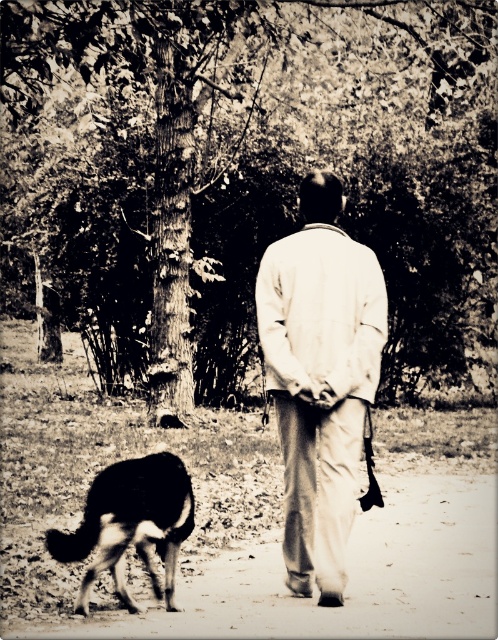
Based on the scene described, can you determine if the white cotton shirt at center is wider than the black fur dog at lower left?

The white cotton shirt at center might be wider than black fur dog at lower left according to the description.